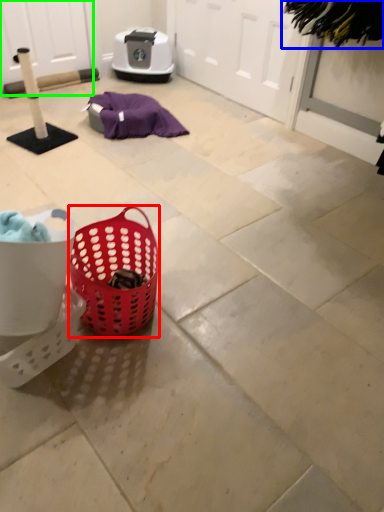
Question: Based on their relative distances, which object is nearer to picnic basket (highlighted by a red box)? Choose from clothe (highlighted by a blue box) and screen door (highlighted by a green box).

Choices:
 (A) clothe
 (B) screen door

Answer: (A)